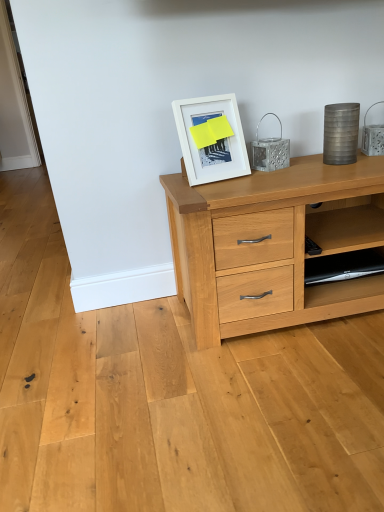
What do you see at coordinates (340, 275) in the screenshot? Image resolution: width=384 pixels, height=512 pixels. I see `black plastic shelf at lower right` at bounding box center [340, 275].

Find the location of a particular element. black plastic shelf at lower right is located at coordinates (340, 275).

Where is `white matte picture frame at upper center`? This screenshot has height=512, width=384. white matte picture frame at upper center is located at coordinates (211, 138).

This screenshot has width=384, height=512. Describe the element at coordinates (211, 138) in the screenshot. I see `white matte picture frame at upper center` at that location.

The image size is (384, 512). I want to click on black plastic shelf at lower right, so click(340, 275).

Considering the relative positions of black plastic shelf at lower right and white matte picture frame at upper center in the image provided, is black plastic shelf at lower right to the left or to the right of white matte picture frame at upper center?

Based on their positions, black plastic shelf at lower right is located to the right of white matte picture frame at upper center.

Is black plastic shelf at lower right in front of white matte picture frame at upper center?

No, the depth of black plastic shelf at lower right is greater than that of white matte picture frame at upper center.

Is point (373, 252) behind point (197, 125)?

Yes, it is.

From the image's perspective, relative to white matte picture frame at upper center, is black plastic shelf at lower right above or below?

Based on their image positions, black plastic shelf at lower right is located beneath white matte picture frame at upper center.

Looking at this image, from a real-world perspective, is black plastic shelf at lower right located higher than white matte picture frame at upper center?

Actually, black plastic shelf at lower right is physically below white matte picture frame at upper center in the real world.

Is black plastic shelf at lower right wider or thinner than white matte picture frame at upper center?

Considering their sizes, black plastic shelf at lower right looks broader than white matte picture frame at upper center.

Is black plastic shelf at lower right shorter than white matte picture frame at upper center?

Indeed, black plastic shelf at lower right has a lesser height compared to white matte picture frame at upper center.

Can you confirm if black plastic shelf at lower right is smaller than white matte picture frame at upper center?

Yes, black plastic shelf at lower right is smaller than white matte picture frame at upper center.

Would you say black plastic shelf at lower right is outside white matte picture frame at upper center?

Yes, black plastic shelf at lower right is not within white matte picture frame at upper center.

Looking at this image, is black plastic shelf at lower right placed right next to white matte picture frame at upper center?

black plastic shelf at lower right and white matte picture frame at upper center are not in contact.

Is black plastic shelf at lower right looking in the opposite direction of white matte picture frame at upper center?

That's not correct — black plastic shelf at lower right is not looking away from white matte picture frame at upper center.

How much distance is there between black plastic shelf at lower right and white matte picture frame at upper center?

black plastic shelf at lower right is 21.79 inches from white matte picture frame at upper center.

You are a GUI agent. You are given a task and a screenshot of the screen. Output one action in this format:
    pyautogui.click(x=<x>, y=<y>)
    Task: Click on the shelf behind the white matte picture frame at upper center
    The width and height of the screenshot is (384, 512).
    Given the screenshot: What is the action you would take?
    pyautogui.click(x=340, y=275)

Visually, is white matte picture frame at upper center positioned to the left or to the right of black plastic shelf at lower right?

In the image, white matte picture frame at upper center appears on the left side of black plastic shelf at lower right.

Does white matte picture frame at upper center lie behind black plastic shelf at lower right?

No, white matte picture frame at upper center is in front of black plastic shelf at lower right.

Is point (209, 176) positioned behind point (356, 267)?

No.

From the image's perspective, is white matte picture frame at upper center above black plastic shelf at lower right?

Yes, from the image's perspective, white matte picture frame at upper center is above black plastic shelf at lower right.

From a real-world perspective, does white matte picture frame at upper center sit lower than black plastic shelf at lower right?

No, from a real-world perspective, white matte picture frame at upper center is not beneath black plastic shelf at lower right.

Is white matte picture frame at upper center wider or thinner than black plastic shelf at lower right?

Clearly, white matte picture frame at upper center has less width compared to black plastic shelf at lower right.

Considering the relative sizes of white matte picture frame at upper center and black plastic shelf at lower right in the image provided, is white matte picture frame at upper center taller than black plastic shelf at lower right?

Indeed, white matte picture frame at upper center has a greater height compared to black plastic shelf at lower right.

Considering the sizes of objects white matte picture frame at upper center and black plastic shelf at lower right in the image provided, who is bigger, white matte picture frame at upper center or black plastic shelf at lower right?

white matte picture frame at upper center is bigger.

Is white matte picture frame at upper center spatially inside black plastic shelf at lower right, or outside of it?

white matte picture frame at upper center is not inside black plastic shelf at lower right, it's outside.

Are white matte picture frame at upper center and black plastic shelf at lower right far apart?

No, white matte picture frame at upper center is not far away from black plastic shelf at lower right.

Could you tell me if white matte picture frame at upper center is turned towards black plastic shelf at lower right?

No, white matte picture frame at upper center is not turned towards black plastic shelf at lower right.

What's the angular difference between white matte picture frame at upper center and black plastic shelf at lower right's facing directions?

The facing directions of white matte picture frame at upper center and black plastic shelf at lower right are 14.4 degrees apart.

Identify the location of picture frame above the black plastic shelf at lower right (from the image's perspective). (211, 138).

Where is `picture frame above the black plastic shelf at lower right (from a real-world perspective)`? picture frame above the black plastic shelf at lower right (from a real-world perspective) is located at coordinates (211, 138).

Find the location of a particular element. shelf directly beneath the white matte picture frame at upper center (from a real-world perspective) is located at coordinates (340, 275).